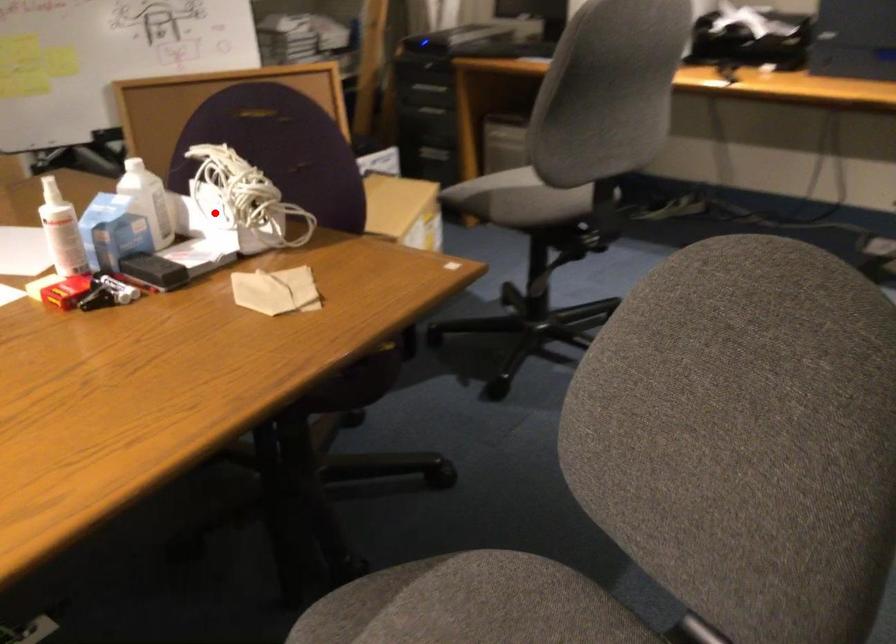
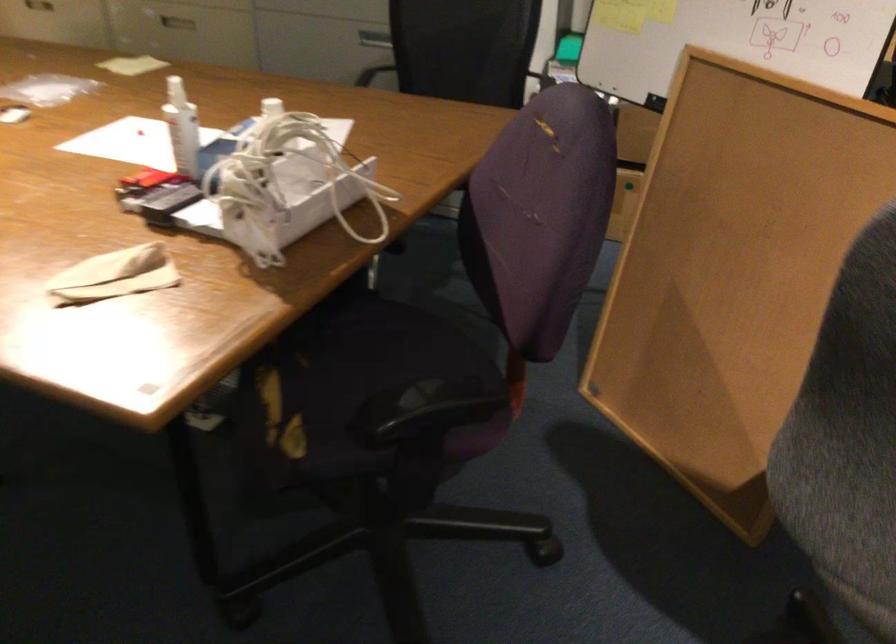
Question: I am providing you with two images of the same scene from different viewpoints. A red point is shown in image1. For the corresponding object point in image2, is it positioned nearer or farther from the camera?

Choices:
 (A) Nearer
 (B) Farther

Answer: (A)